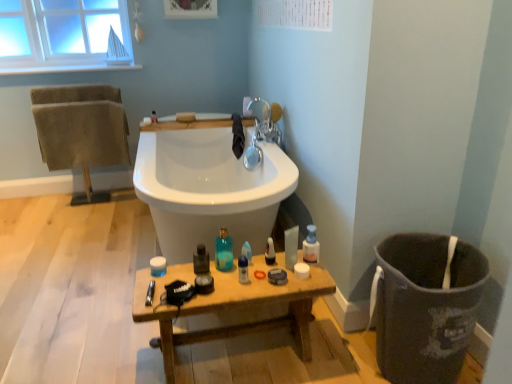
This screenshot has width=512, height=384. Identify the location of vacant space underneath wooden table at lower center (from a real-world perspective). (227, 346).